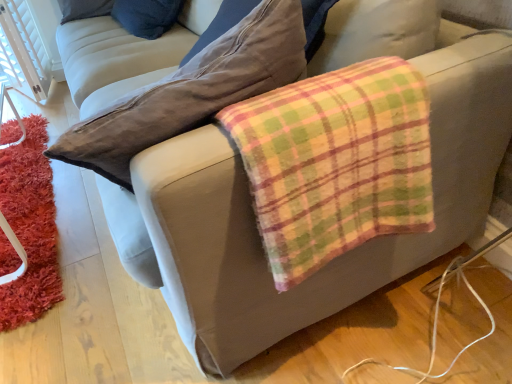
Question: Is fluffy orange rug at lower left taller or shorter than plaid flannel blanket at lower right?

Choices:
 (A) short
 (B) tall

Answer: (A)

Question: Does point (36, 162) appear closer or farther from the camera than point (409, 150)?

Choices:
 (A) farther
 (B) closer

Answer: (A)

Question: Would you say fluffy orange rug at lower left is to the left or to the right of plaid flannel blanket at lower right in the picture?

Choices:
 (A) left
 (B) right

Answer: (A)

Question: From a real-world perspective, relative to fluffy orange rug at lower left, is plaid flannel blanket at lower right vertically above or below?

Choices:
 (A) below
 (B) above

Answer: (B)

Question: Considering the positions of plaid flannel blanket at lower right and fluffy orange rug at lower left in the image, is plaid flannel blanket at lower right wider or thinner than fluffy orange rug at lower left?

Choices:
 (A) thin
 (B) wide

Answer: (A)

Question: Based on their sizes in the image, would you say plaid flannel blanket at lower right is bigger or smaller than fluffy orange rug at lower left?

Choices:
 (A) small
 (B) big

Answer: (B)

Question: Considering the positions of plaid flannel blanket at lower right and fluffy orange rug at lower left in the image, is plaid flannel blanket at lower right taller or shorter than fluffy orange rug at lower left?

Choices:
 (A) short
 (B) tall

Answer: (B)